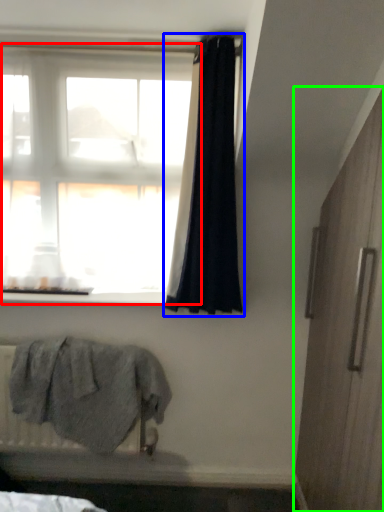
Question: Based on their relative distances, which object is farther from window (highlighted by a red box)? Choose from curtain (highlighted by a blue box) and screen door (highlighted by a green box).

Choices:
 (A) curtain
 (B) screen door

Answer: (B)